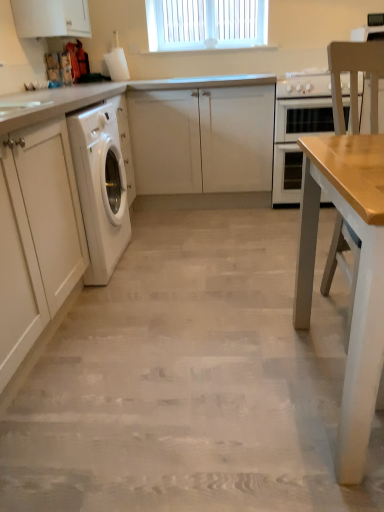
Question: In terms of width, does white plastic window at upper center look wider or thinner when compared to white glossy oven at center?

Choices:
 (A) wide
 (B) thin

Answer: (B)

Question: Considering the positions of point (173, 50) and point (291, 91), is point (173, 50) closer or farther from the camera than point (291, 91)?

Choices:
 (A) closer
 (B) farther

Answer: (B)

Question: Which object is positioned closest to the white plastic window at upper center?

Choices:
 (A) white glossy stove at upper right
 (B) white matte cabinet at left, marked as the 1th cabinetry in a front-to-back arrangement
 (C) white matte cabinet at center, positioned as the second cabinetry in top-to-bottom order
 (D) light beige wood floor at center
 (E) white matte cabinet at upper left, acting as the first cabinetry starting from the top

Answer: (A)

Question: Which object is positioned farthest from the light wood chair at right?

Choices:
 (A) white glossy stove at upper right
 (B) light beige wood floor at center
 (C) white plastic window at upper center
 (D) white glossy oven at center
 (E) white matte cabinet at center, positioned as the second cabinetry in top-to-bottom order

Answer: (C)